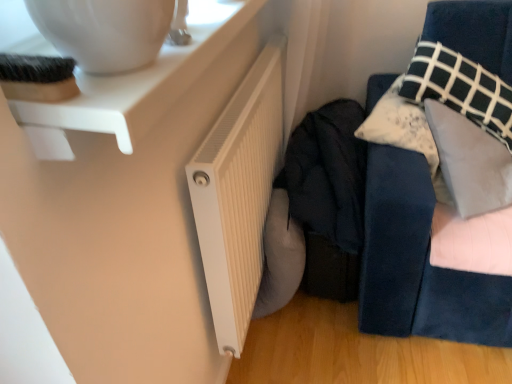
Question: From the image's perspective, would you say velvet blue sofa at right is positioned over dark fabric jacket at center?

Choices:
 (A) yes
 (B) no

Answer: (A)

Question: Is velvet blue sofa at right not within dark fabric jacket at center?

Choices:
 (A) yes
 (B) no

Answer: (A)

Question: Is velvet blue sofa at right not close to dark fabric jacket at center?

Choices:
 (A) yes
 (B) no

Answer: (B)

Question: Is velvet blue sofa at right wider than dark fabric jacket at center?

Choices:
 (A) yes
 (B) no

Answer: (B)

Question: Is dark fabric jacket at center at the back of velvet blue sofa at right?

Choices:
 (A) no
 (B) yes

Answer: (A)

Question: Considering the relative sizes of velvet blue sofa at right and dark fabric jacket at center in the image provided, is velvet blue sofa at right smaller than dark fabric jacket at center?

Choices:
 (A) yes
 (B) no

Answer: (A)

Question: Is dark fabric jacket at center positioned beyond the bounds of white ribbed radiator at lower center?

Choices:
 (A) yes
 (B) no

Answer: (A)

Question: Does dark fabric jacket at center turn towards white ribbed radiator at lower center?

Choices:
 (A) no
 (B) yes

Answer: (A)

Question: From a real-world perspective, is dark fabric jacket at center located beneath white ribbed radiator at lower center?

Choices:
 (A) no
 (B) yes

Answer: (B)

Question: Is white ribbed radiator at lower center at the back of dark fabric jacket at center?

Choices:
 (A) no
 (B) yes

Answer: (A)

Question: Considering the relative sizes of dark fabric jacket at center and white ribbed radiator at lower center in the image provided, is dark fabric jacket at center shorter than white ribbed radiator at lower center?

Choices:
 (A) yes
 (B) no

Answer: (A)

Question: Considering the relative positions of dark fabric jacket at center and white ribbed radiator at lower center in the image provided, is dark fabric jacket at center to the left of white ribbed radiator at lower center from the viewer's perspective?

Choices:
 (A) no
 (B) yes

Answer: (A)

Question: Considering the relative positions of white ribbed radiator at lower center and velvet blue sofa at right in the image provided, is white ribbed radiator at lower center to the left of velvet blue sofa at right from the viewer's perspective?

Choices:
 (A) no
 (B) yes

Answer: (B)